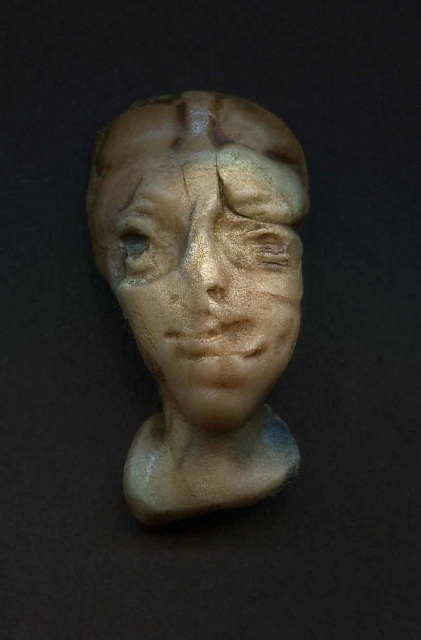
Which of these two, matte gold bust at center or matte brown eyebrow at center, stands taller?

matte gold bust at center

Does point (208, 493) come farther from viewer compared to point (135, 182)?

Yes.

Which is in front, point (232, 145) or point (128, 200)?

Point (232, 145) is in front.

Identify the location of matte gold bust at center. (205, 292).

Which is above, matte gold bust at center or matte brown eye at center?

matte brown eye at center is above.

From the picture: Does matte gold bust at center appear over matte brown eye at center?

No.

Is point (189, 406) closer to viewer compared to point (140, 241)?

Yes, it is in front of point (140, 241).

I want to click on matte gold bust at center, so click(x=205, y=292).

Which of these two, matte brown eye at center or matte brown eyebrow at center, stands shorter?

Standing shorter between the two is matte brown eyebrow at center.

Can you confirm if matte brown eye at center is positioned below matte brown eyebrow at center?

Yes.

The image size is (421, 640). I want to click on matte brown eye at center, so click(135, 240).